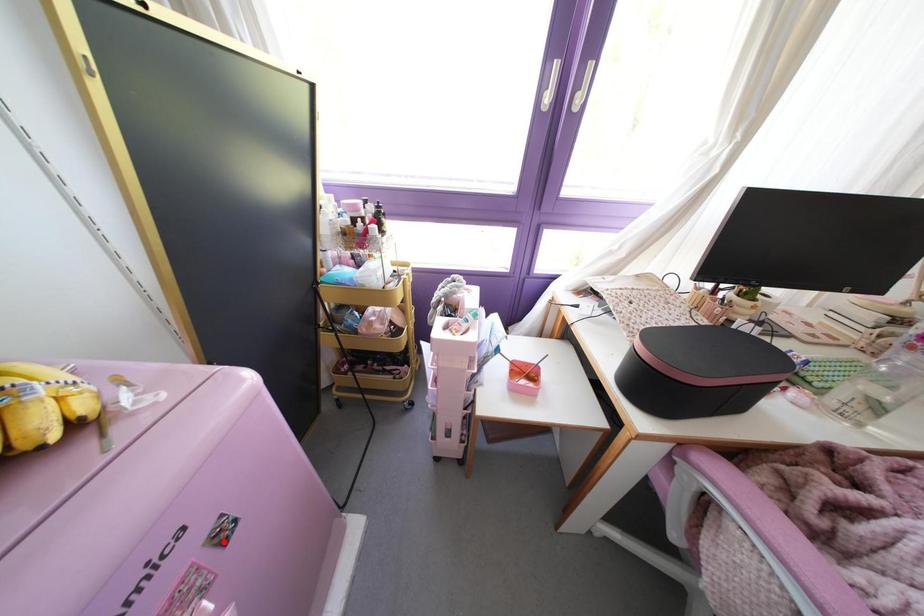
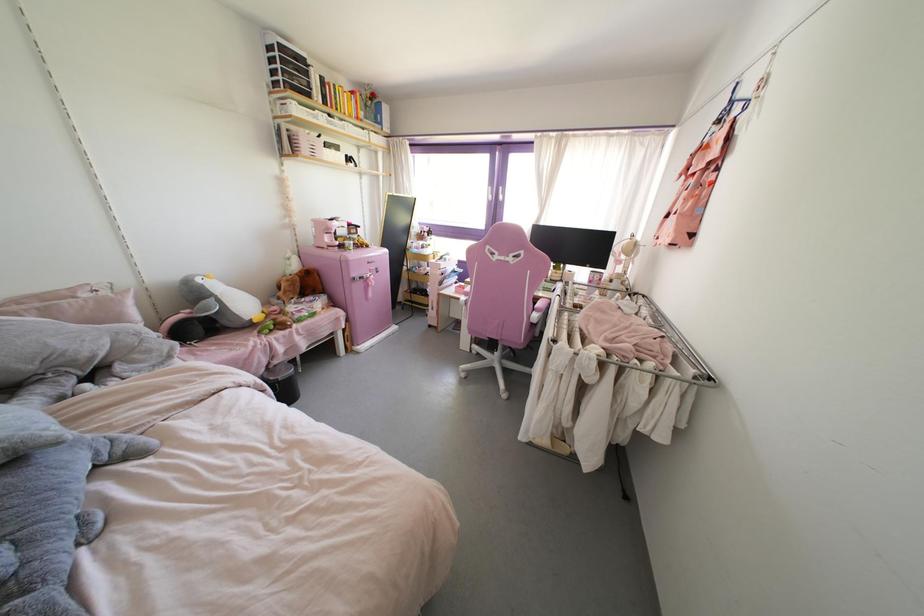
In the second image, find the point that corresponds to the highlighted location in the first image.

(377, 272)